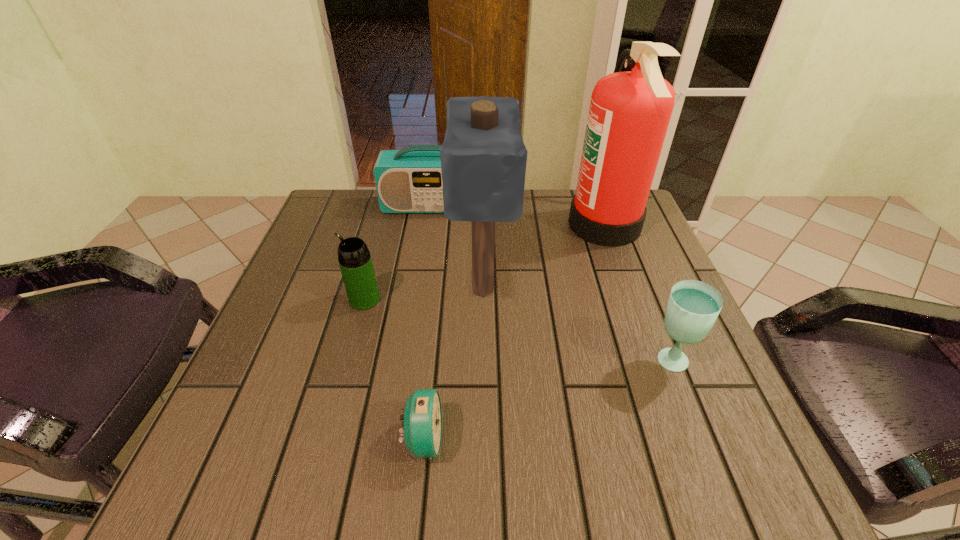
Find the location of `blank region between the second nearest object and the thermos bottle`. blank region between the second nearest object and the thermos bottle is located at coordinates (516, 330).

Where is `vacant space in between the alarm clock and the mallet`? Image resolution: width=960 pixels, height=540 pixels. vacant space in between the alarm clock and the mallet is located at coordinates (453, 364).

This screenshot has width=960, height=540. What are the coordinates of `vacant region between the glass and the thermos bottle` in the screenshot? It's located at (516, 330).

At what (x,y) coordinates should I click in order to perform the action: click on vacant region between the fifth farthest object and the shortest object. Please return your answer as a coordinate pair (x, y). Image resolution: width=960 pixels, height=540 pixels. Looking at the image, I should click on (546, 401).

Identify the location of vacant area that lies between the mallet and the radio receiver. (457, 247).

Locate which object is the fourth closest to the thermos bottle. Please provide its 2D coordinates. Your answer should be formatted as a tuple, i.e. [(x, y)], where the tuple contains the x and y coordinates of a point satisfying the conditions above.

[(629, 113)]

The width and height of the screenshot is (960, 540). Identify the location of the closest object to the radio receiver. (483, 157).

You are a GUI agent. You are given a task and a screenshot of the screen. Output one action in this format:
    pyautogui.click(x=<x>, y=<y>)
    Task: Click on the free space that satisfies the following two spatial constraints: 1. at the nozzle of the fire extinguisher; 2. on the left side of the glass
    The width and height of the screenshot is (960, 540).
    Given the screenshot: What is the action you would take?
    pyautogui.click(x=654, y=361)

Where is `vacant point that satisfies the following two spatial constraints: 1. from the spout of the thermos bottle; 2. on the back side of the fifth farthest object`? Image resolution: width=960 pixels, height=540 pixels. vacant point that satisfies the following two spatial constraints: 1. from the spout of the thermos bottle; 2. on the back side of the fifth farthest object is located at coordinates (348, 361).

Identify the location of vacant region that satisfies the following two spatial constraints: 1. at the nozzle of the glass; 2. on the right side of the fire extinguisher. The image size is (960, 540). (654, 361).